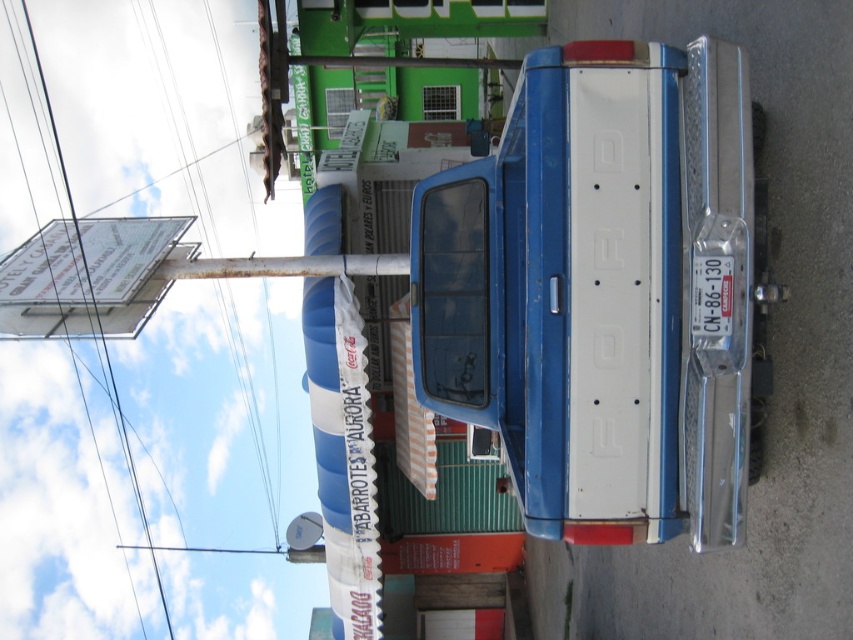
Can you confirm if blue metallic truck at center is taller than white wire at upper left?

No.

Does point (689, 212) come in front of point (270, 468)?

Yes, point (689, 212) is closer to viewer.

Who is more forward, (x=460, y=205) or (x=224, y=83)?

Point (x=460, y=205) is in front.

The height and width of the screenshot is (640, 853). I want to click on blue metallic truck at center, so click(x=601, y=291).

Does white wire at upper left have a lesser height compared to metallic wire at upper left?

Correct, white wire at upper left is not as tall as metallic wire at upper left.

Is white wire at upper left smaller than metallic wire at upper left?

Indeed, white wire at upper left has a smaller size compared to metallic wire at upper left.

Where is `white wire at upper left`? white wire at upper left is located at coordinates (189, 122).

Who is lower down, blue metallic truck at center or metallic wire at upper left?

metallic wire at upper left is below.

Can you confirm if blue metallic truck at center is positioned above metallic wire at upper left?

Correct, blue metallic truck at center is located above metallic wire at upper left.

What are the coordinates of `blue metallic truck at center` in the screenshot? It's located at (601, 291).

The height and width of the screenshot is (640, 853). I want to click on blue metallic truck at center, so 601,291.